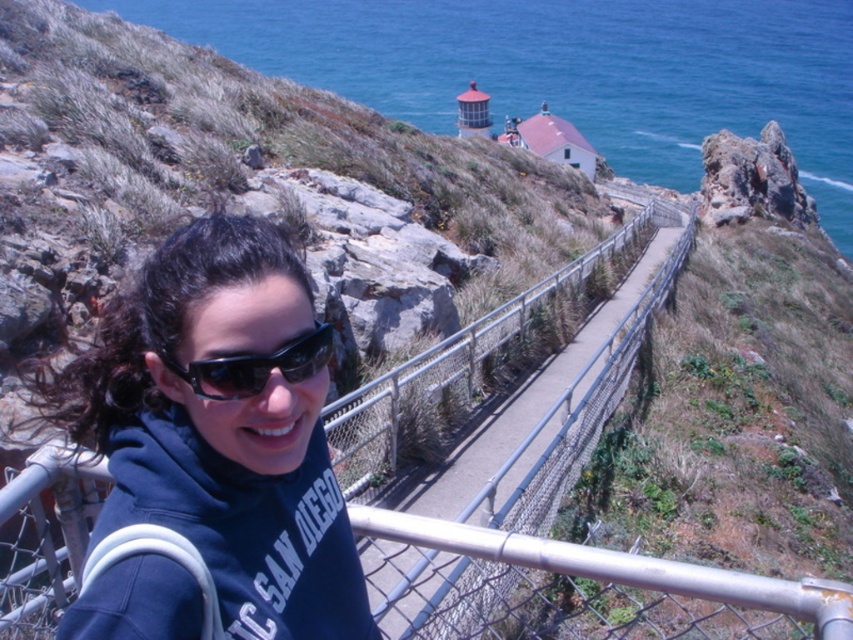
Who is taller, dark blue hoodie at center or blue water at upper center?

With more height is blue water at upper center.

Is dark blue hoodie at center positioned behind blue water at upper center?

No, dark blue hoodie at center is closer to the viewer.

Is point (326, 324) positioned behind point (850, 97)?

No, (326, 324) is closer to viewer.

This screenshot has height=640, width=853. Find the location of `dark blue hoodie at center`. dark blue hoodie at center is located at coordinates (224, 426).

Who is higher up, blue water at upper center or metal fence at center?

Positioned higher is blue water at upper center.

Is point (410, 60) closer to viewer compared to point (57, 516)?

No, (410, 60) is further to viewer.

Image resolution: width=853 pixels, height=640 pixels. Describe the element at coordinates (567, 68) in the screenshot. I see `blue water at upper center` at that location.

Locate an element on the screen. blue water at upper center is located at coordinates (567, 68).

Does blue water at upper center have a smaller size compared to black plastic sunglasses at center?

No.

Is blue water at upper center closer to the viewer compared to black plastic sunglasses at center?

No.

Consider the image. Who is more forward, (833, 148) or (318, 356)?

Positioned in front is point (318, 356).

Where is `blue water at upper center`? blue water at upper center is located at coordinates (567, 68).